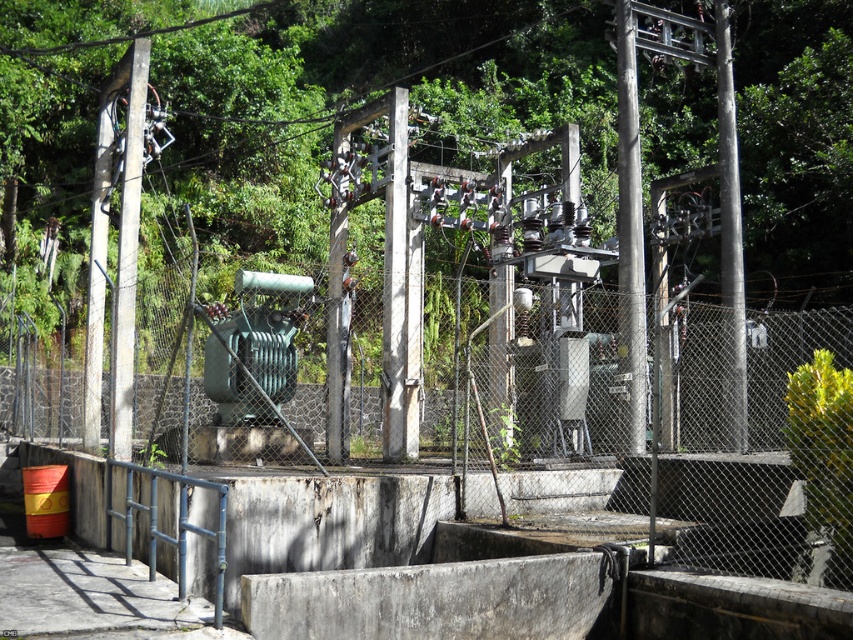
Question: Which of the following is the closest to the observer?

Choices:
 (A) (396, 444)
 (B) (733, 148)
 (C) (115, 369)

Answer: (C)

Question: Can you confirm if smooth gray pole at right is positioned to the right of smooth concrete pole at left?

Choices:
 (A) yes
 (B) no

Answer: (A)

Question: Can you confirm if rusty metal pole at center is positioned to the right of smooth gray pole at right?

Choices:
 (A) yes
 (B) no

Answer: (B)

Question: Which object is positioned farthest from the rusty metal pole at center?

Choices:
 (A) smooth concrete pole at left
 (B) smooth gray pole at right
 (C) white concrete pole at center

Answer: (A)

Question: Which point is farther to the camera?

Choices:
 (A) (637, 227)
 (B) (726, 288)
 (C) (392, 241)
 (D) (117, 310)

Answer: (B)

Question: Can you confirm if smooth gray pole at right is thinner than smooth concrete pole at left?

Choices:
 (A) no
 (B) yes

Answer: (B)